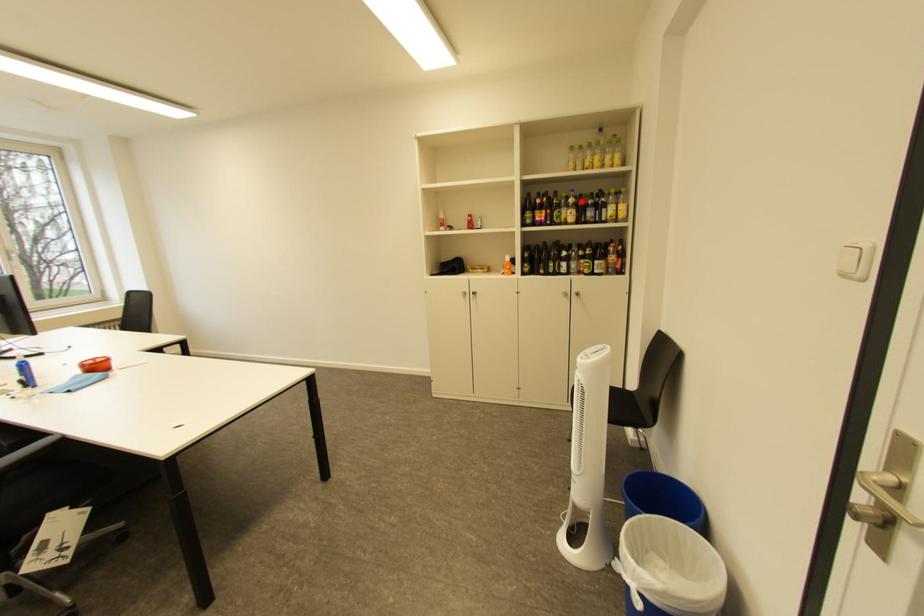
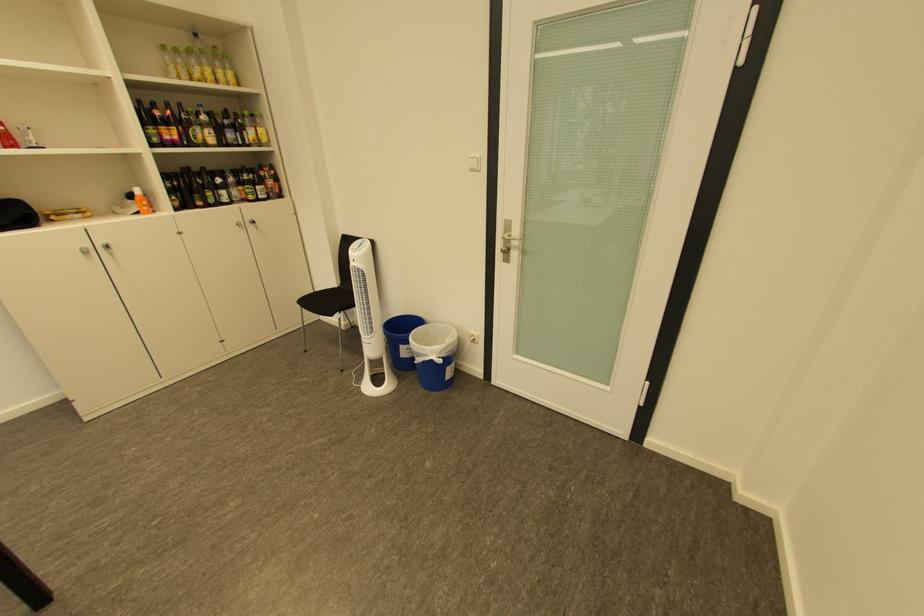
Locate, in the second image, the point that corresponds to the highlighted location in the first image.

(213, 119)